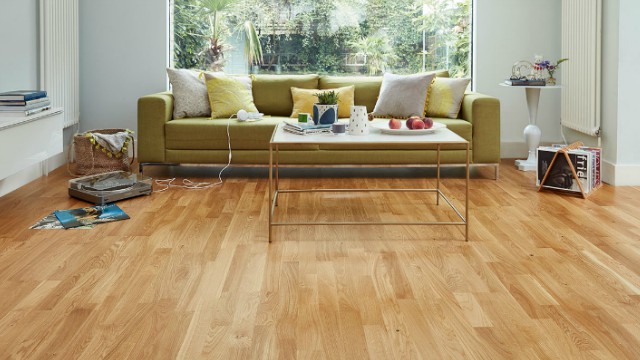
Find the location of a particular element. This screenshot has width=640, height=360. window behind couch is located at coordinates (349, 40).